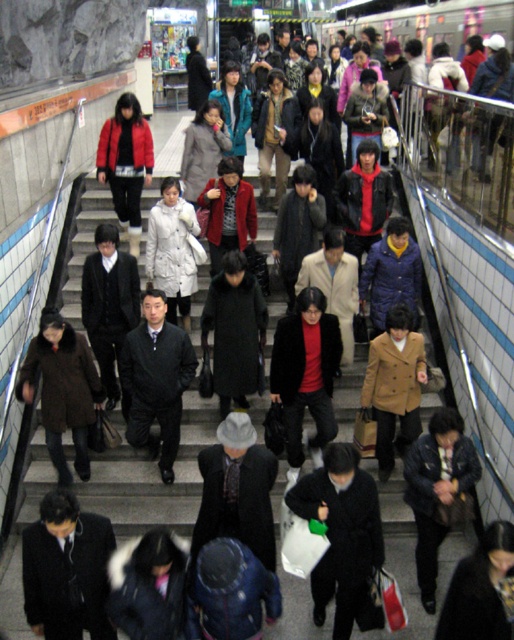
You are a person standing at the top of the subway station stairs and want to quickly identify two coats in the crowd. The coats are both at the center of your view. Which of the two coats, the black matte coat at center or the matte brown coat at center, is taller?

The black matte coat at center is much taller than the matte brown coat at center.

You are a fashion designer observing the subway station scene. You notice two coats at the center of the image. How far apart are the black matte coat at center and the black wool coat at center?

The black matte coat at center and the black wool coat at center are 63.13 centimeters apart from each other.

You are a person trying to walk through the subway station and you see two coats hanging on adjacent hooks at the center. The coats are labeled as black matte coat at center and black wool coat at center. Which coat would require more space on the hook due to its width?

The black matte coat at center might be wider than black wool coat at center, so it would require more space on the hook.